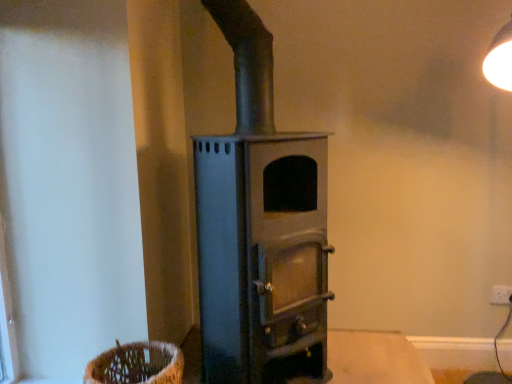
What do you see at coordinates (260, 228) in the screenshot? The image size is (512, 384). I see `matte gray wood burning stove at center` at bounding box center [260, 228].

Where is `smooth wooden table at center`? The width and height of the screenshot is (512, 384). smooth wooden table at center is located at coordinates (375, 359).

Based on their positions, is white plastic electric outlet at lower right located to the left or right of smooth wooden table at center?

white plastic electric outlet at lower right is to the right of smooth wooden table at center.

Is white plastic electric outlet at lower right facing away from smooth wooden table at center?

white plastic electric outlet at lower right does not have its back to smooth wooden table at center.

You are a GUI agent. You are given a task and a screenshot of the screen. Output one action in this format:
    pyautogui.click(x=<x>, y=<y>)
    Task: Click on the table that appears below the white plastic electric outlet at lower right (from the image's perspective)
    The image size is (512, 384).
    Given the screenshot: What is the action you would take?
    [375, 359]

From the picture: From a real-world perspective, which object rests below the other?

smooth wooden table at center is physically lower.

Is woven brown basket at lower left surrounding smooth wooden table at center?

That's incorrect, smooth wooden table at center is not inside woven brown basket at lower left.

From the image's perspective, is woven brown basket at lower left located above smooth wooden table at center?

Yes.

Image resolution: width=512 pixels, height=384 pixels. Identify the location of basket in front of the smooth wooden table at center. (137, 364).

Considering the sizes of woven brown basket at lower left and smooth wooden table at center in the image, is woven brown basket at lower left bigger or smaller than smooth wooden table at center?

Considering their sizes, woven brown basket at lower left takes up less space than smooth wooden table at center.

Does point (116, 360) come farther from viewer compared to point (285, 192)?

No, it is in front of (285, 192).

Can you confirm if woven brown basket at lower left is wider than matte gray wood burning stove at center?

In fact, woven brown basket at lower left might be narrower than matte gray wood burning stove at center.

How distant is woven brown basket at lower left from matte gray wood burning stove at center?

woven brown basket at lower left and matte gray wood burning stove at center are 21.30 inches apart from each other.

Is the position of woven brown basket at lower left more distant than that of matte gray wood burning stove at center?

Yes.

Identify the location of electric outlet to the right of woven brown basket at lower left. This screenshot has width=512, height=384. (500, 295).

In the scene shown: From a real-world perspective, is woven brown basket at lower left physically above white plastic electric outlet at lower right?

Actually, woven brown basket at lower left is physically below white plastic electric outlet at lower right in the real world.

Considering the relative positions of woven brown basket at lower left and white plastic electric outlet at lower right in the image provided, is woven brown basket at lower left to the right of white plastic electric outlet at lower right from the viewer's perspective?

In fact, woven brown basket at lower left is to the left of white plastic electric outlet at lower right.

Is the depth of woven brown basket at lower left greater than that of white plastic electric outlet at lower right?

That is False.

From a real-world perspective, is white plastic electric outlet at lower right beneath woven brown basket at lower left?

No, from a real-world perspective, white plastic electric outlet at lower right is not beneath woven brown basket at lower left.

Is white plastic electric outlet at lower right in contact with woven brown basket at lower left?

They are not placed beside each other.

Find the location of `basket below the white plastic electric outlet at lower right (from the image's perspective)`. basket below the white plastic electric outlet at lower right (from the image's perspective) is located at coordinates [137, 364].

Considering the sizes of objects white plastic electric outlet at lower right and woven brown basket at lower left in the image provided, who is smaller, white plastic electric outlet at lower right or woven brown basket at lower left?

white plastic electric outlet at lower right.

Is white plastic electric outlet at lower right aimed at matte gray wood burning stove at center?

No, white plastic electric outlet at lower right does not turn towards matte gray wood burning stove at center.

Is white plastic electric outlet at lower right wider than matte gray wood burning stove at center?

No, white plastic electric outlet at lower right is not wider than matte gray wood burning stove at center.

From the image's perspective, is white plastic electric outlet at lower right on matte gray wood burning stove at center?

Incorrect, from the image's perspective, white plastic electric outlet at lower right is lower than matte gray wood burning stove at center.

Is smooth wooden table at center thinner than woven brown basket at lower left?

No.

Is smooth wooden table at center to the left or to the right of woven brown basket at lower left in the image?

In the image, smooth wooden table at center appears on the right side of woven brown basket at lower left.

Who is shorter, smooth wooden table at center or woven brown basket at lower left?

With less height is smooth wooden table at center.

Is smooth wooden table at center with woven brown basket at lower left?

No, smooth wooden table at center is not touching woven brown basket at lower left.

Where is `electric outlet positioned vertically above the smooth wooden table at center (from a real-world perspective)`? electric outlet positioned vertically above the smooth wooden table at center (from a real-world perspective) is located at coordinates (500, 295).

The height and width of the screenshot is (384, 512). I want to click on basket in front of the smooth wooden table at center, so click(x=137, y=364).

In the scene shown: Based on their spatial positions, is white plastic electric outlet at lower right or matte gray wood burning stove at center closer to woven brown basket at lower left?

Among the two, matte gray wood burning stove at center is located nearer to woven brown basket at lower left.

When comparing their distances from white plastic electric outlet at lower right, does matte gray wood burning stove at center or woven brown basket at lower left seem further?

The object further to white plastic electric outlet at lower right is woven brown basket at lower left.

Estimate the real-world distances between objects in this image. Which object is further from white plastic electric outlet at lower right, woven brown basket at lower left or matte gray wood burning stove at center?

Among the two, woven brown basket at lower left is located further to white plastic electric outlet at lower right.

When comparing their distances from woven brown basket at lower left, does matte gray wood burning stove at center or white plastic electric outlet at lower right seem further?

Among the two, white plastic electric outlet at lower right is located further to woven brown basket at lower left.

Estimate the real-world distances between objects in this image. Which object is closer to matte gray wood burning stove at center, woven brown basket at lower left or smooth wooden table at center?

woven brown basket at lower left.

Which object lies nearer to the anchor point smooth wooden table at center, white plastic electric outlet at lower right or woven brown basket at lower left?

white plastic electric outlet at lower right.

Estimate the real-world distances between objects in this image. Which object is further from woven brown basket at lower left, smooth wooden table at center or white plastic electric outlet at lower right?

white plastic electric outlet at lower right is positioned further to the anchor woven brown basket at lower left.

When comparing their distances from smooth wooden table at center, does white plastic electric outlet at lower right or matte gray wood burning stove at center seem further?

matte gray wood burning stove at center is positioned further to the anchor smooth wooden table at center.

Locate an element on the screen. The image size is (512, 384). table between matte gray wood burning stove at center and white plastic electric outlet at lower right in the horizontal direction is located at coordinates (375, 359).

The image size is (512, 384). Identify the location of table between woven brown basket at lower left and white plastic electric outlet at lower right in the horizontal direction. (375, 359).

Where is `wood burning stove between woven brown basket at lower left and white plastic electric outlet at lower right in the horizontal direction`? wood burning stove between woven brown basket at lower left and white plastic electric outlet at lower right in the horizontal direction is located at coordinates (260, 228).

Where is `basket between matte gray wood burning stove at center and smooth wooden table at center in the vertical direction`? This screenshot has width=512, height=384. basket between matte gray wood burning stove at center and smooth wooden table at center in the vertical direction is located at coordinates (137, 364).